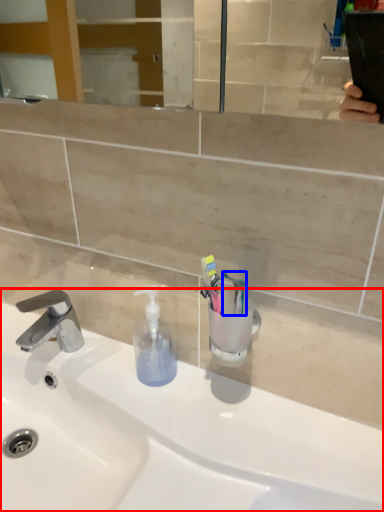
Question: Which of the following is the closest to the observer, sink (highlighted by a red box) or toothbrush (highlighted by a blue box)?

Choices:
 (A) sink
 (B) toothbrush

Answer: (A)